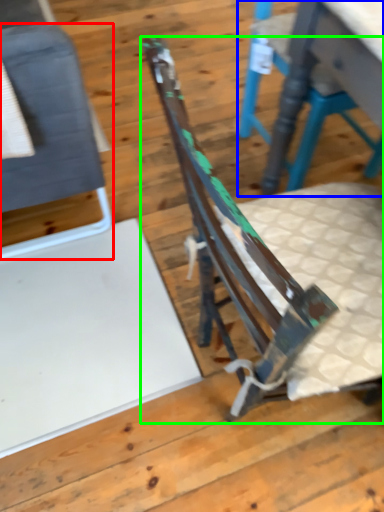
Question: Estimate the real-world distances between objects in this image. Which object is closer to chair (highlighted by a red box), chair (highlighted by a blue box) or chair (highlighted by a green box)?

Choices:
 (A) chair
 (B) chair

Answer: (B)